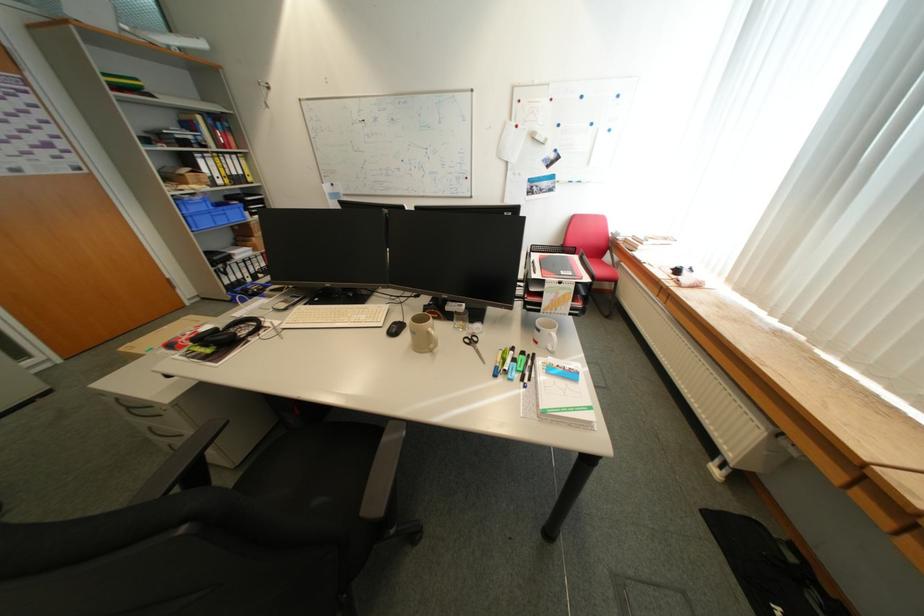
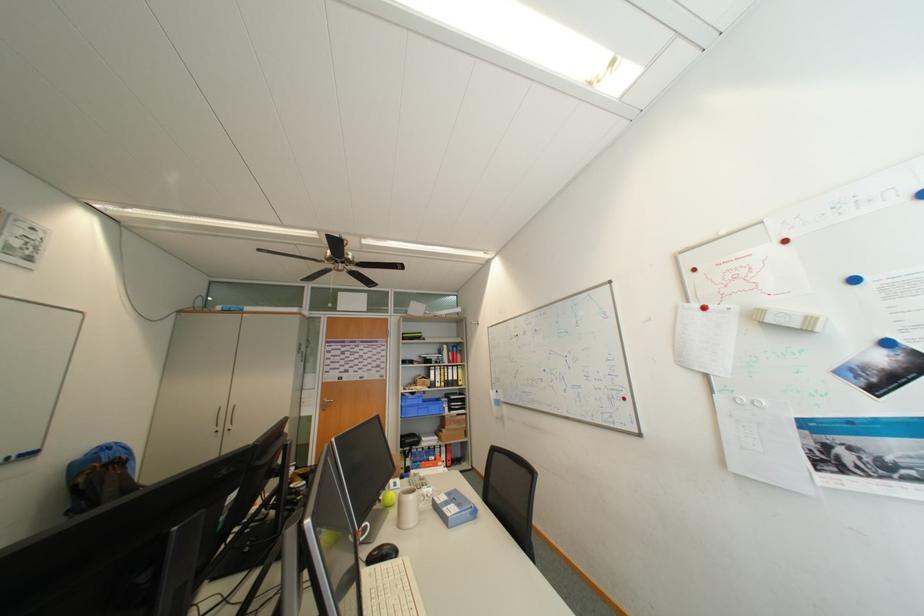
The point at (x=213, y=209) is marked in the first image. Where is the corresponding point in the second image?

(426, 403)